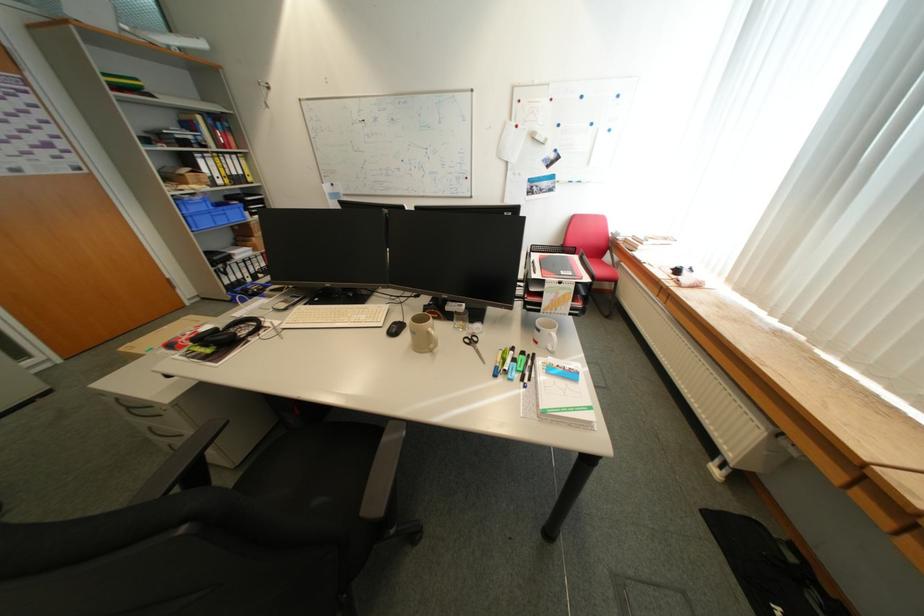
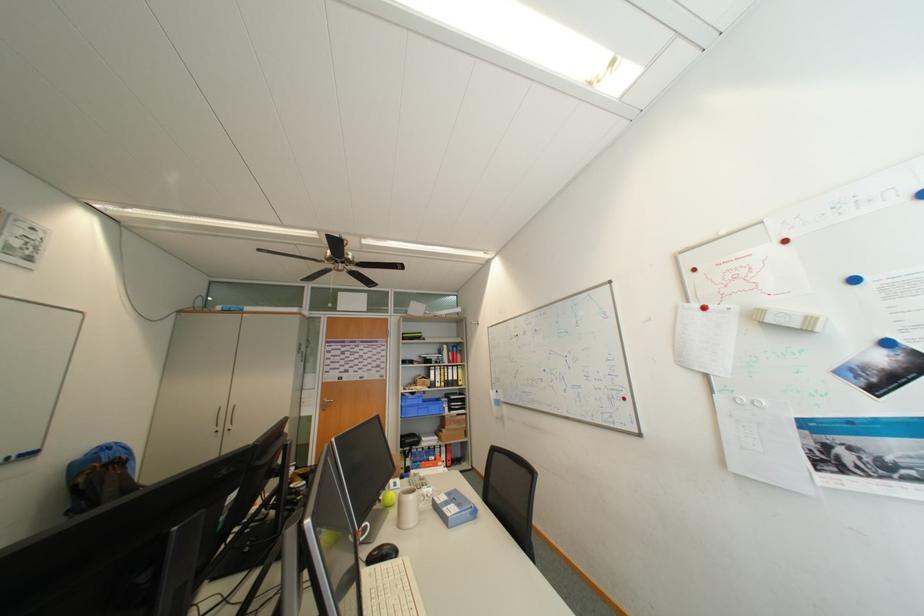
The point at (x=213, y=209) is marked in the first image. Where is the corresponding point in the second image?

(426, 403)